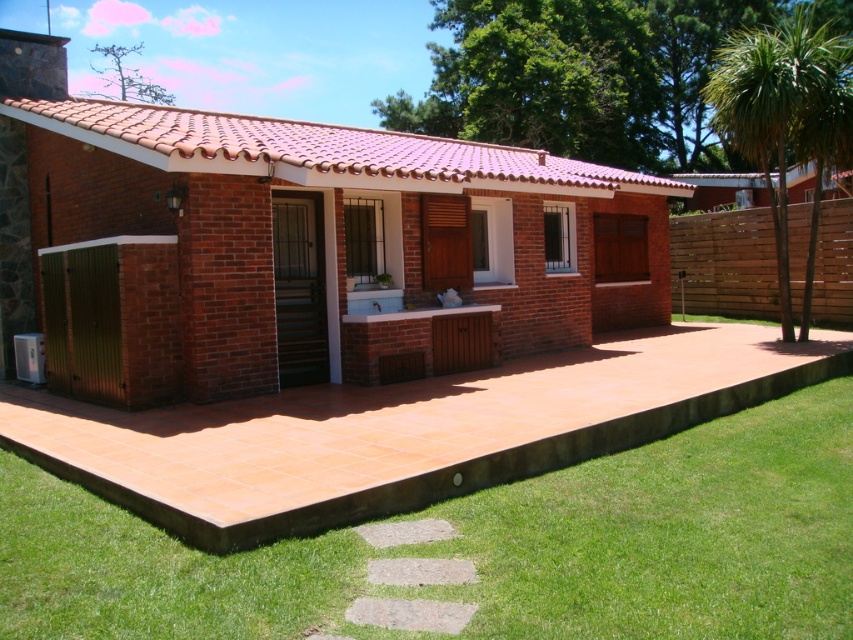
Question: Is terracotta tile terrace at center smaller than green leafy palm tree at right?

Choices:
 (A) no
 (B) yes

Answer: (B)

Question: Among these points, which one is nearest to the camera?

Choices:
 (A) (735, 68)
 (B) (844, 611)
 (C) (154, 106)

Answer: (B)

Question: Which point is closer to the camera?

Choices:
 (A) terracotta tile terrace at center
 (B) green grass at lower left
 (C) green leafy palm tree at right

Answer: (B)

Question: From the image, what is the correct spatial relationship of terracotta tile terrace at center in relation to green grass at lower left?

Choices:
 (A) left
 (B) right

Answer: (A)

Question: Considering the relative positions of terracotta tile terrace at center and green grass at lower left in the image provided, where is terracotta tile terrace at center located with respect to green grass at lower left?

Choices:
 (A) above
 (B) below

Answer: (A)

Question: Which object is the closest to the terracotta tile terrace at center?

Choices:
 (A) green grass at lower left
 (B) green leafy palm tree at right

Answer: (B)